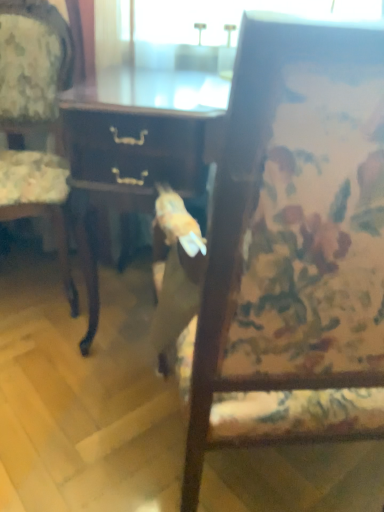
Where is `vacant region under wooden floral-patterned chair at left, placed as the second chair when sorted from right to left (from a real-world perspective)`? The width and height of the screenshot is (384, 512). vacant region under wooden floral-patterned chair at left, placed as the second chair when sorted from right to left (from a real-world perspective) is located at coordinates (28, 286).